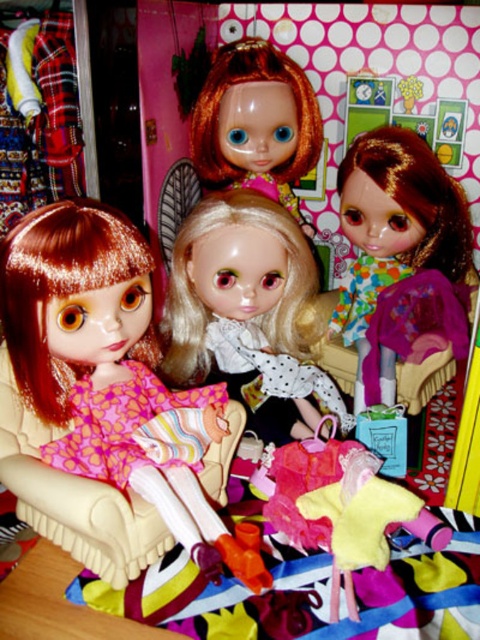
Question: Considering the real-world distances, which object is farthest from the shiny purple fabric at center?

Choices:
 (A) matte pink fabric dress at center
 (B) shiny pink dress at center
 (C) shiny blonde wig at center
 (D) shiny brown hair at upper center

Answer: (B)

Question: Can you confirm if matte pink fabric dress at center is wider than shiny brown hair at upper center?

Choices:
 (A) no
 (B) yes

Answer: (A)

Question: Based on their relative distances, which object is farther from the shiny brown hair at upper center?

Choices:
 (A) shiny blonde wig at center
 (B) shiny pink dress at center

Answer: (B)

Question: Where is shiny pink dress at center located in relation to shiny blonde wig at center in the image?

Choices:
 (A) left
 (B) right

Answer: (A)

Question: Is shiny pink dress at center above matte pink fabric dress at center?

Choices:
 (A) yes
 (B) no

Answer: (A)

Question: Which of the following is the closest to the observer?

Choices:
 (A) (301, 116)
 (B) (286, 518)

Answer: (B)